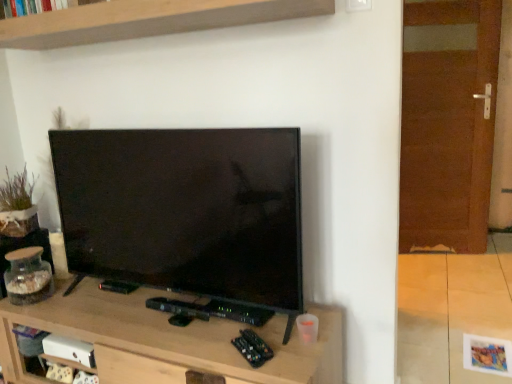
Question: Is brown wooden door at right to the left or to the right of clear glass jar at left in the image?

Choices:
 (A) left
 (B) right

Answer: (B)

Question: In terms of size, does brown wooden door at right appear bigger or smaller than clear glass jar at left?

Choices:
 (A) big
 (B) small

Answer: (A)

Question: Which is nearer to the wooden shelf at upper center?

Choices:
 (A) clear glass jar at left
 (B) wooden tv stand at center
 (C) brown wooden door at right

Answer: (A)

Question: Which object is positioned farthest from the brown wooden door at right?

Choices:
 (A) wooden tv stand at center
 (B) wooden shelf at upper center
 (C) clear glass jar at left

Answer: (C)